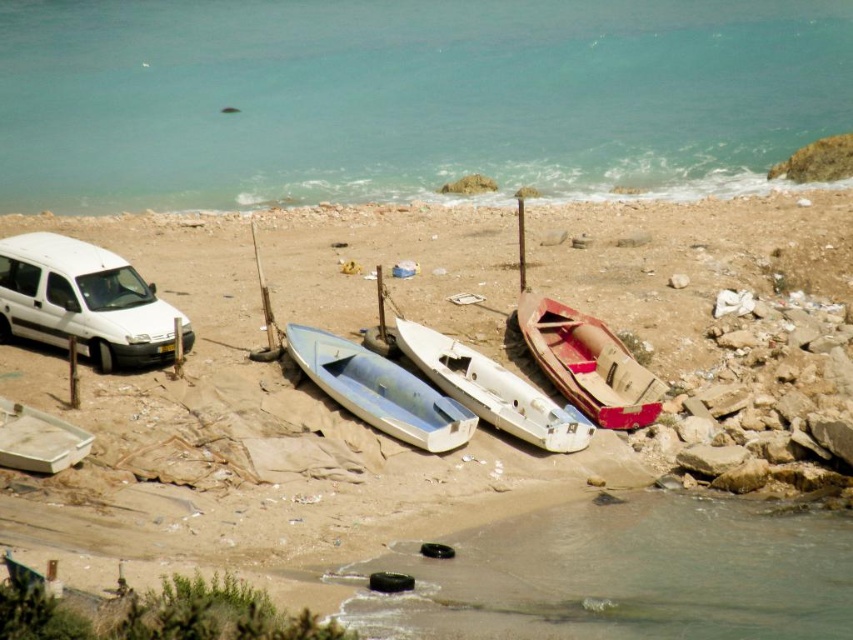
Question: Estimate the real-world distances between objects in this image. Which object is farther from the white matte van at left?

Choices:
 (A) white plastic canoe at center
 (B) metallic boats at center
 (C) metallic silver canoe at center

Answer: (A)

Question: Is clear blue water at upper center in front of white plastic canoe at center?

Choices:
 (A) no
 (B) yes

Answer: (A)

Question: Does white matte van at left have a lesser width compared to metallic silver canoe at center?

Choices:
 (A) no
 (B) yes

Answer: (A)

Question: Which point is closer to the camera?

Choices:
 (A) white plastic canoe at center
 (B) white matte van at left
 (C) wooden canoe at center

Answer: (A)

Question: Which point is closer to the camera?

Choices:
 (A) (410, 358)
 (B) (843, 8)

Answer: (A)

Question: Is white matte van at left smaller than white plastic canoe at center?

Choices:
 (A) yes
 (B) no

Answer: (B)